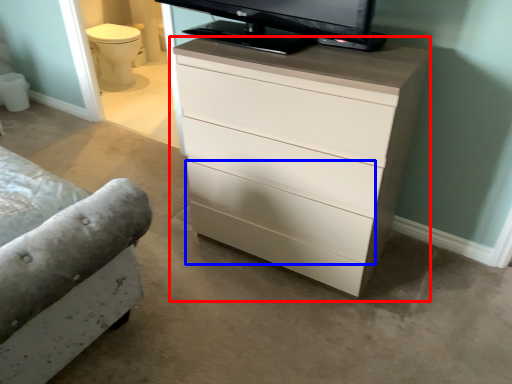
Question: Among these objects, which one is nearest to the camera, chest of drawers (highlighted by a red box) or drawer (highlighted by a blue box)?

Choices:
 (A) chest of drawers
 (B) drawer

Answer: (A)